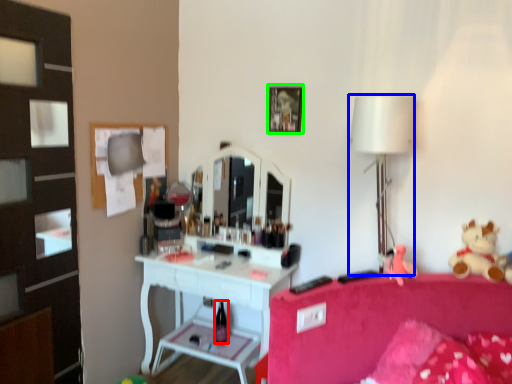
Question: Estimate the real-world distances between objects in this image. Which object is farther from bottle (highlighted by a red box), lamp (highlighted by a blue box) or picture frame (highlighted by a green box)?

Choices:
 (A) lamp
 (B) picture frame

Answer: (A)